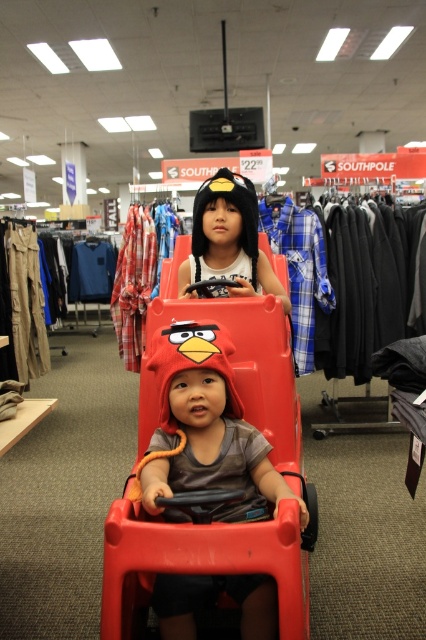
Which is above, matte plastic toy car at center or matte black hat at center?

Positioned higher is matte black hat at center.

Can you confirm if matte plastic toy car at center is smaller than matte black hat at center?

Actually, matte plastic toy car at center might be larger than matte black hat at center.

Describe the element at coordinates (213, 464) in the screenshot. I see `matte plastic toy car at center` at that location.

Identify the location of matte plastic toy car at center. This screenshot has height=640, width=426. (213, 464).